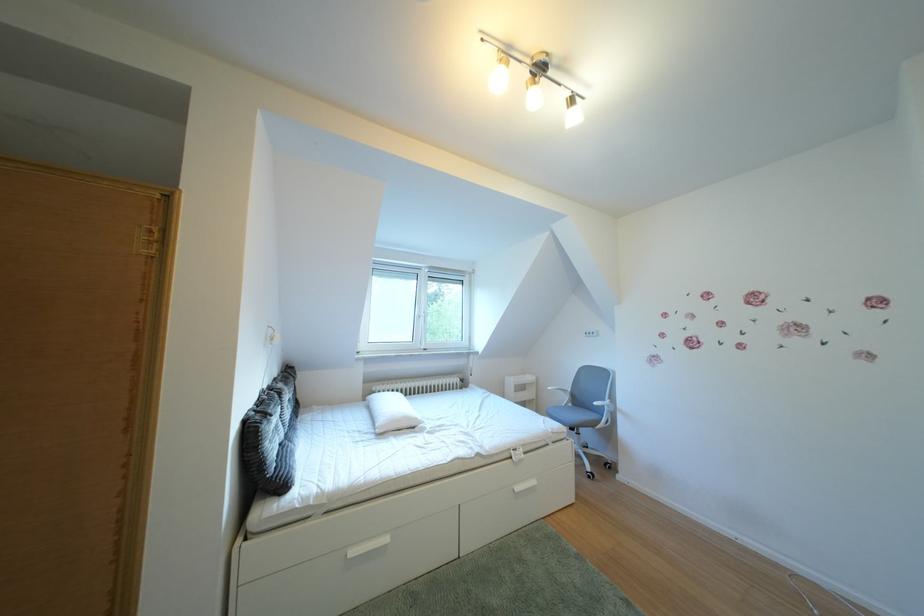
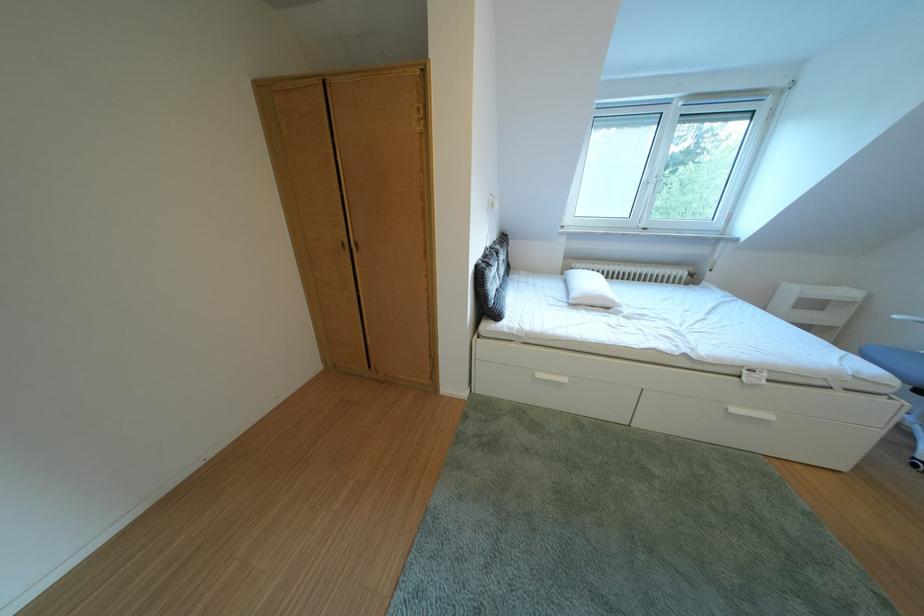
Locate, in the second image, the point that corresponds to (367,559) in the first image.

(553, 381)